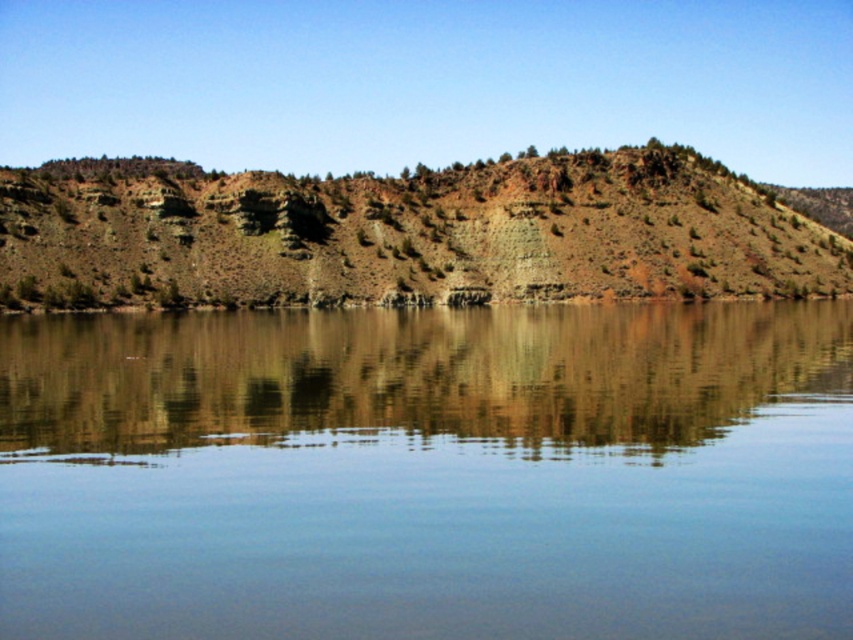
You are a hiker who wants to cross the clear glass water at center. You notice a brown matte rock at center nearby. Which object is lower in elevation?

The clear glass water at center is below the brown matte rock at center, so the clear glass water at center is lower in elevation.

You are a hiker who wants to cross the clear glass water at center and the brown matte rock at center. Which object can you step on?

The brown matte rock at center can be stepped on because it is a solid surface, while the clear glass water at center is a body of water and cannot be stepped on.

Consider the image. You are a hiker carrying a 3.5 meter long hiking pole. You are standing at the clear glass water at center and want to reach the brown matte rock at center. Can your hiking pole reach the rock without you moving closer?

The clear glass water at center and brown matte rock at center are 4.12 meters apart from each other. Since the hiking pole is only 3.5 meters long, it cannot reach the rock without moving closer.